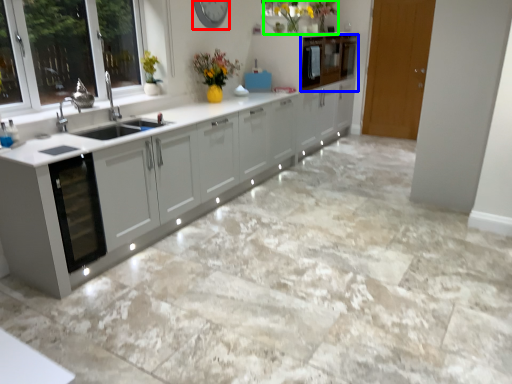
Question: Which object is positioned farthest from clock (highlighted by a red box)? Select from cabinetry (highlighted by a blue box) and floral arrangement (highlighted by a green box).

Choices:
 (A) cabinetry
 (B) floral arrangement

Answer: (A)